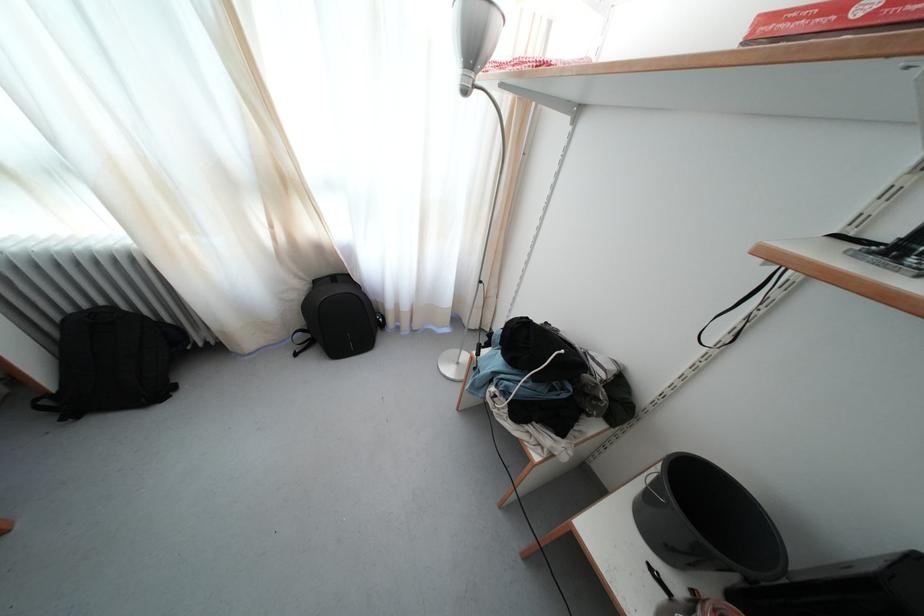
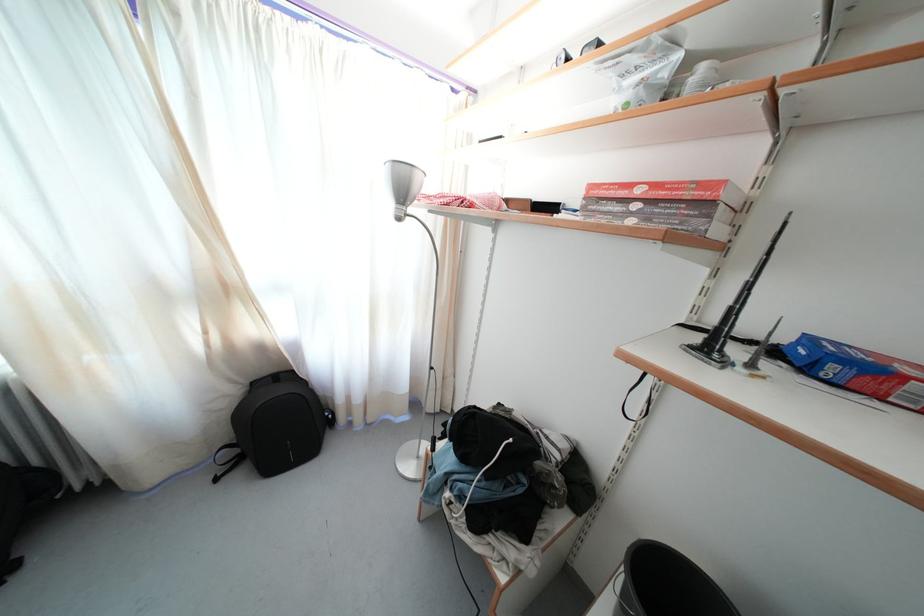
In the second image, find the point that corresponds to (322,288) in the first image.

(259, 390)